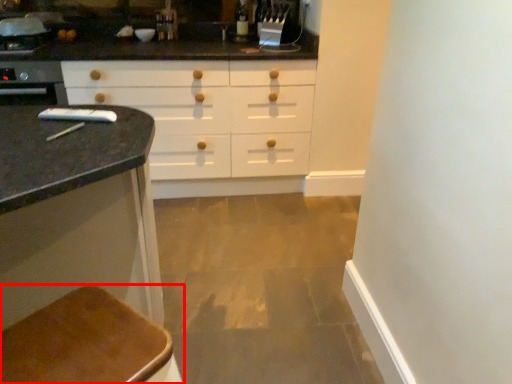
Question: Observing the image, what is the correct spatial positioning of furniture (annotated by the red box) in reference to faucet?

Choices:
 (A) left
 (B) right

Answer: (B)